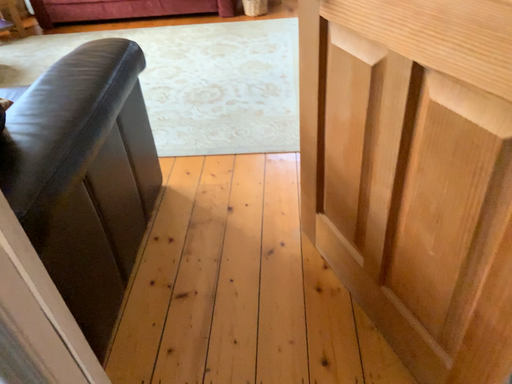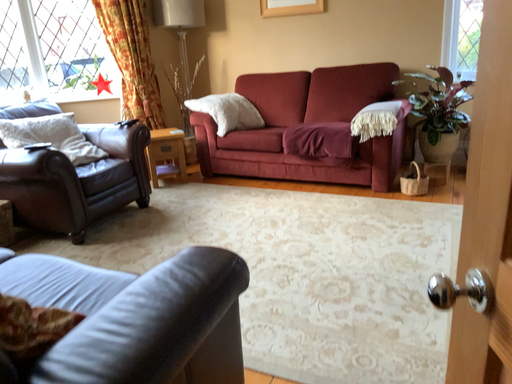
Question: Which way did the camera rotate in the video?

Choices:
 (A) rotated right
 (B) rotated left

Answer: (B)